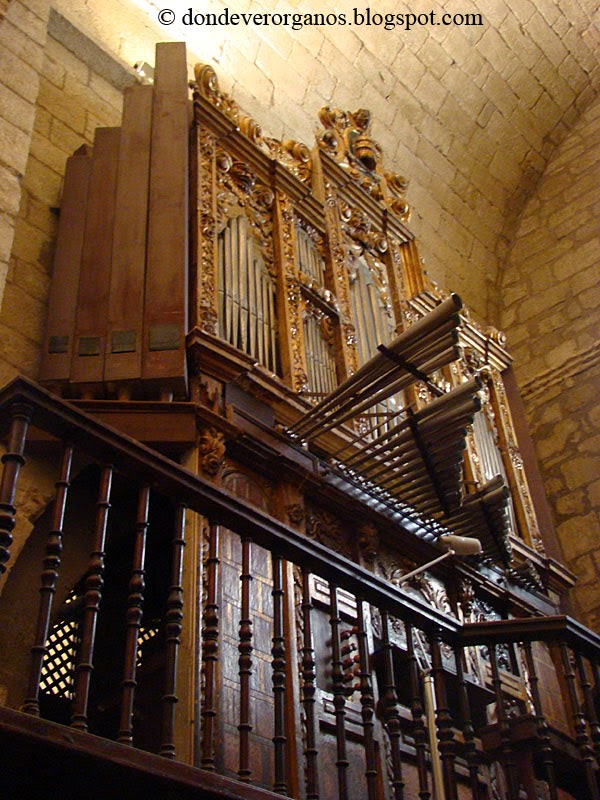
Locate an element on the screen. handrail is located at coordinates (242, 518).